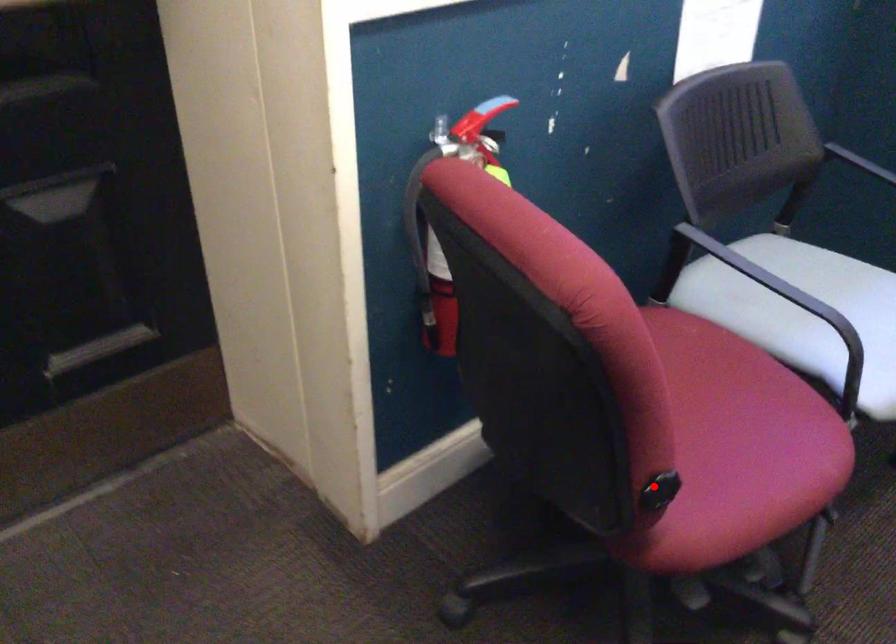
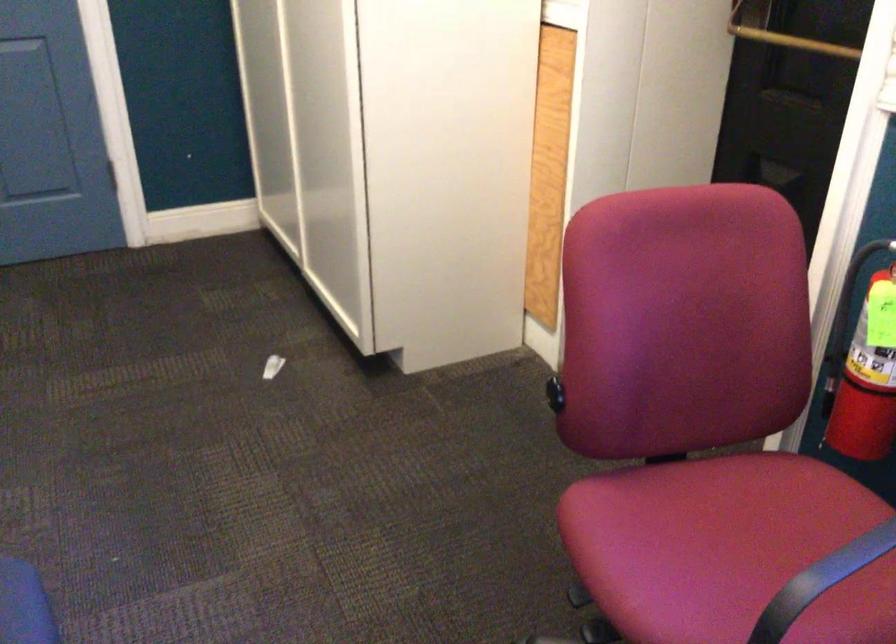
Question: I am providing you with two images of the same scene from different viewpoints. Image1 has a red point marked. In image2, the corresponding 3D location appears at what relative position? Reply with the corresponding letter.

Choices:
 (A) Closer
 (B) Farther

Answer: (B)